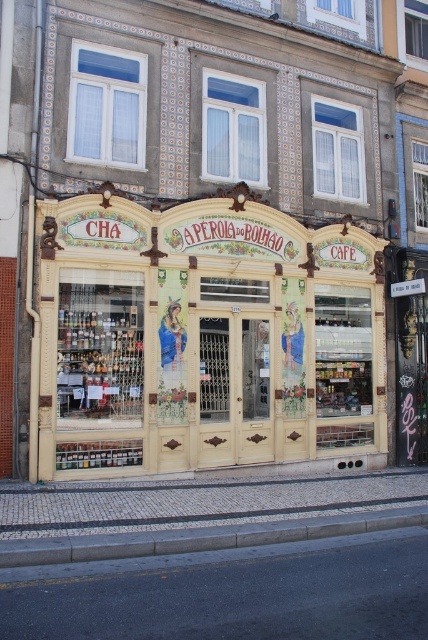
Question: Among these objects, which one is nearest to the camera?

Choices:
 (A) gray concrete curb at lower center
 (B) yellow painted wood storefront at center

Answer: (A)

Question: Which object is farther from the camera taking this photo?

Choices:
 (A) yellow painted wood storefront at center
 (B) gray concrete curb at lower center

Answer: (A)

Question: Which point is closer to the camera?

Choices:
 (A) click(217, 426)
 (B) click(401, 520)

Answer: (B)

Question: From the image, what is the correct spatial relationship of yellow painted wood storefront at center in relation to gray concrete curb at lower center?

Choices:
 (A) below
 (B) above

Answer: (B)

Question: Is yellow painted wood storefront at center thinner than gray concrete curb at lower center?

Choices:
 (A) no
 (B) yes

Answer: (B)

Question: Is yellow painted wood storefront at center wider than gray concrete curb at lower center?

Choices:
 (A) no
 (B) yes

Answer: (A)